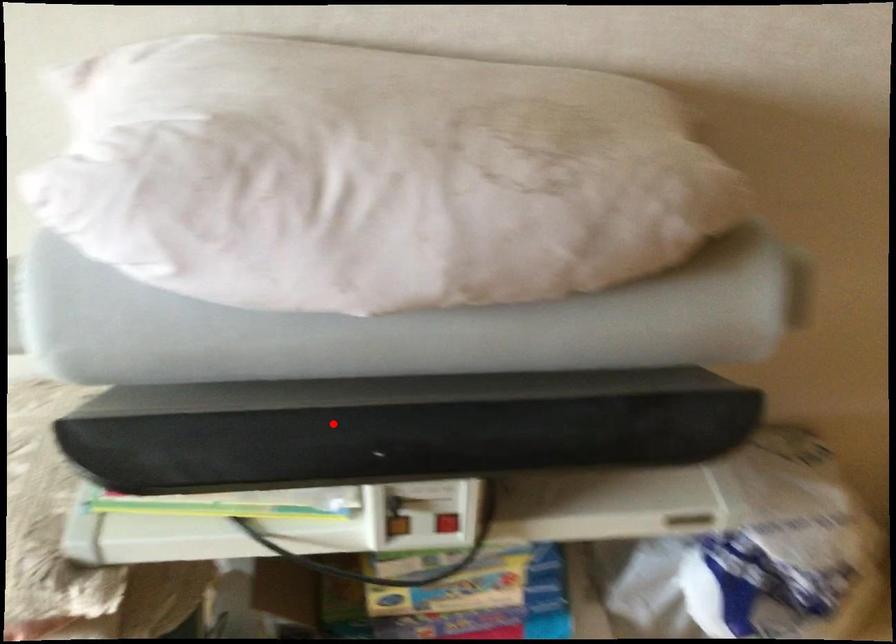
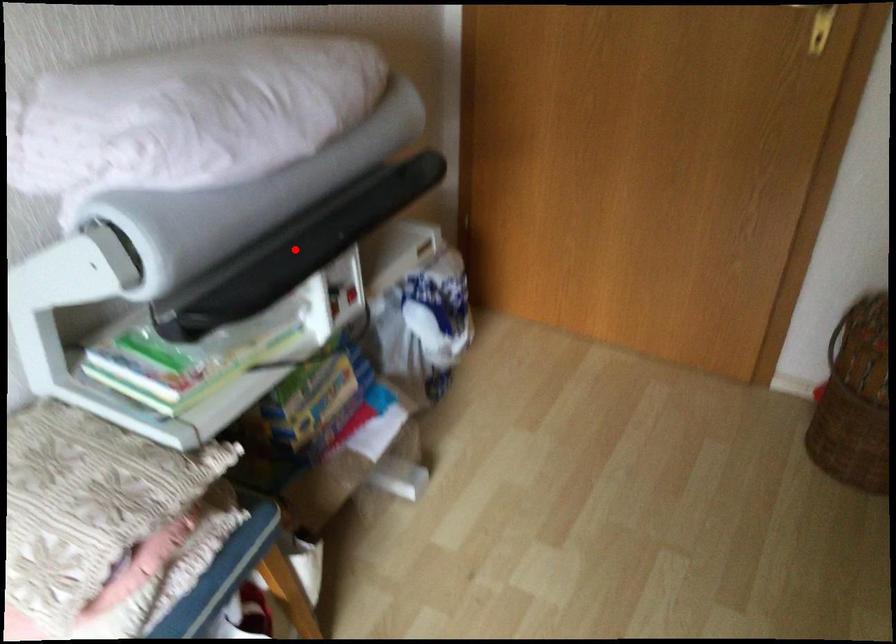
I am providing you with two images of the same scene from different viewpoints. A red point is marked on the first image and another point is marked on the second image. Is the marked point in image1 the same physical position as the marked point in image2?

Yes